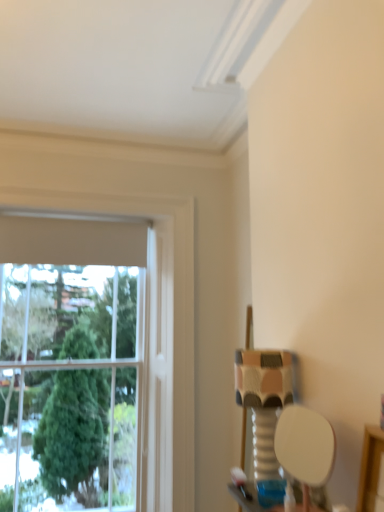
Image resolution: width=384 pixels, height=512 pixels. What do you see at coordinates (170, 364) in the screenshot?
I see `clear glass window at left` at bounding box center [170, 364].

Find the location of `clear glass window at left`. clear glass window at left is located at coordinates (170, 364).

Where is `clear glass window at left`? clear glass window at left is located at coordinates (170, 364).